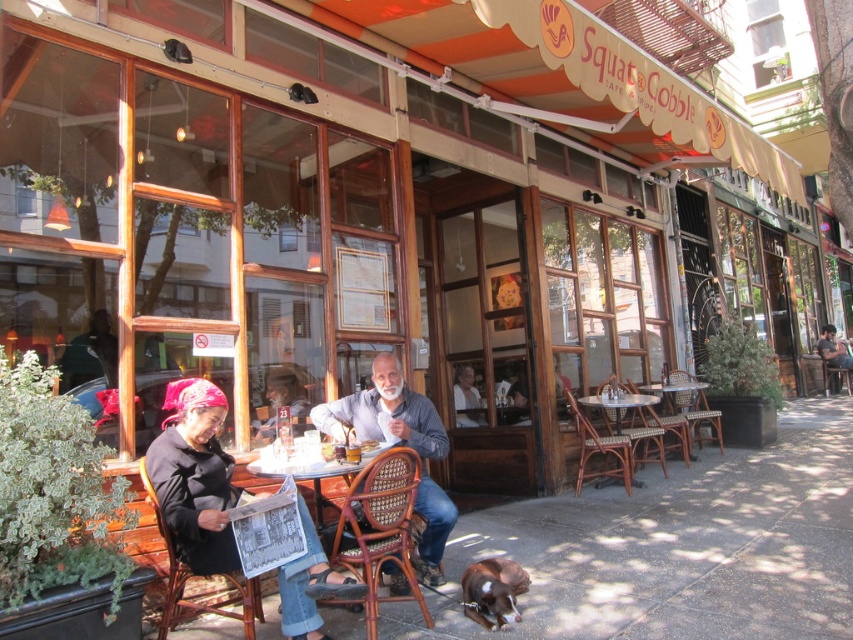
Between brown fur dog at lower center and rustic wooden table at center, which one has more height?

rustic wooden table at center is taller.

Who is more forward, (521,584) or (663,472)?

Point (521,584) is more forward.

The image size is (853, 640). Identify the location of brown fur dog at lower center. (492, 592).

Which of these two, black fabric jacket at center or brown fur dog at lower center, stands shorter?

Standing shorter between the two is brown fur dog at lower center.

Is point (447, 445) less distant than point (476, 605)?

No.

Between point (299, 577) and point (492, 572), which one is positioned behind?

The point (492, 572) is more distant.

The height and width of the screenshot is (640, 853). What are the coordinates of `black fabric jacket at center` in the screenshot? It's located at (194, 477).

Where is `brown fur dog at lower center`? brown fur dog at lower center is located at coordinates (492, 592).

The width and height of the screenshot is (853, 640). I want to click on brown fur dog at lower center, so click(x=492, y=592).

You are a GUI agent. You are given a task and a screenshot of the screen. Output one action in this format:
    pyautogui.click(x=<x>, y=<y>)
    Task: Click on the brown fur dog at lower center
    Image resolution: width=853 pixels, height=640 pixels.
    Given the screenshot: What is the action you would take?
    pyautogui.click(x=492, y=592)